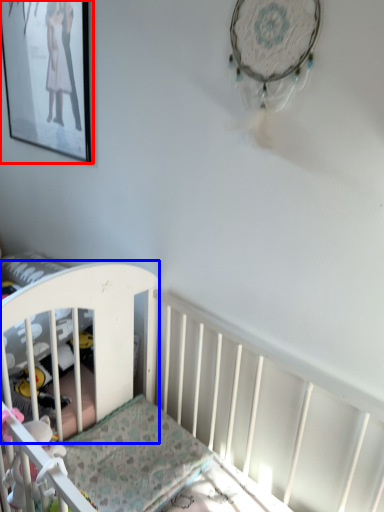
Question: Among these objects, which one is farthest to the camera, picture frame (highlighted by a red box) or infant bed (highlighted by a blue box)?

Choices:
 (A) picture frame
 (B) infant bed

Answer: (A)